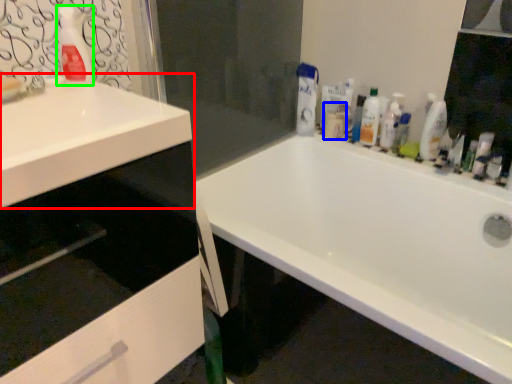
Question: Which is nearer to the sink (highlighted by a red box)? toiletry (highlighted by a blue box) or cleaning product (highlighted by a green box).

Choices:
 (A) toiletry
 (B) cleaning product

Answer: (B)